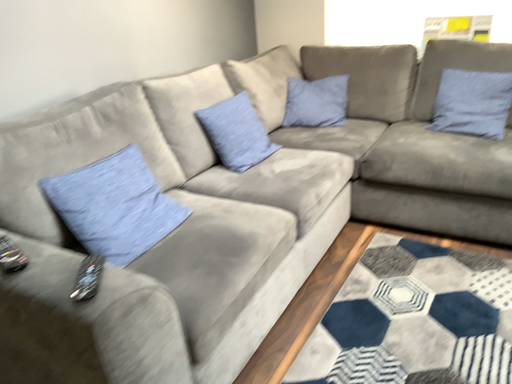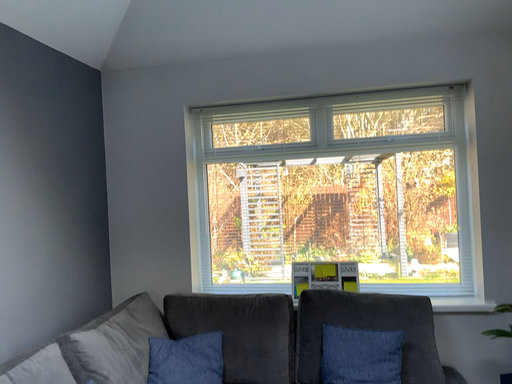
Question: How did the camera likely rotate when shooting the video?

Choices:
 (A) rotated right
 (B) rotated left

Answer: (A)